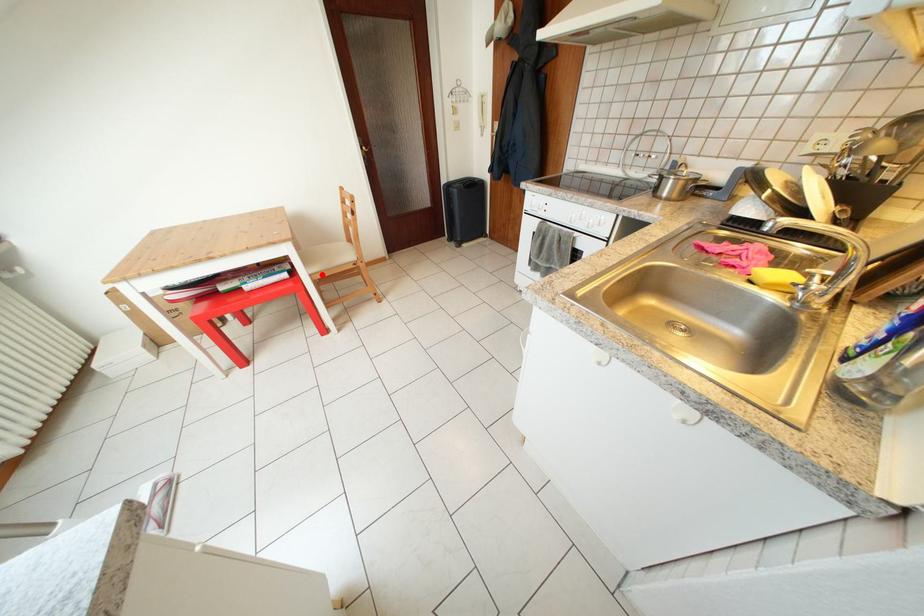
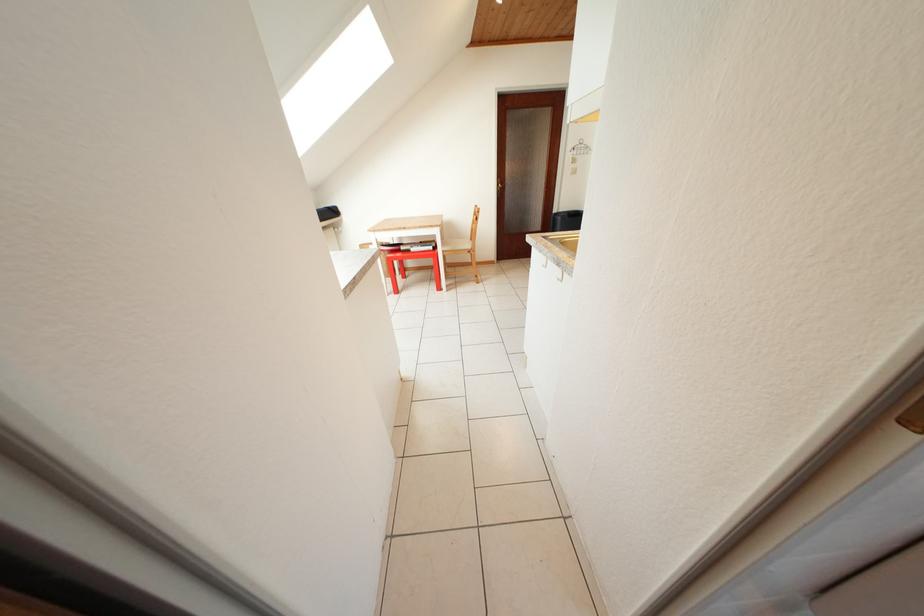
Question: I am providing you with two images of the same scene from different viewpoints. A red point is shown in image1. For the corresponding object point in image2, is it positioned nearer or farther from the camera?

Choices:
 (A) Nearer
 (B) Farther

Answer: (A)